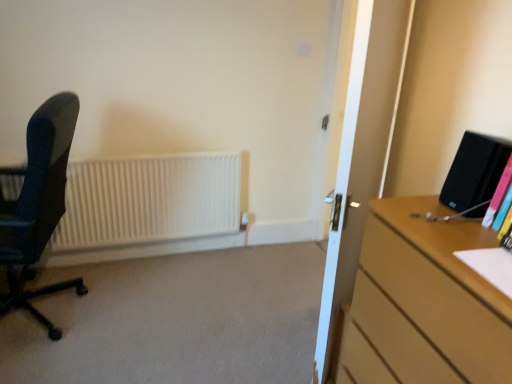
Question: Should I look upward or downward to see transparent glass door at center?

Choices:
 (A) up
 (B) down

Answer: (B)

Question: Is transparent glass door at center smaller than matte black office chair at left?

Choices:
 (A) yes
 (B) no

Answer: (A)

Question: From a real-world perspective, is transparent glass door at center beneath matte black office chair at left?

Choices:
 (A) yes
 (B) no

Answer: (B)

Question: Considering the relative positions of transparent glass door at center and matte black office chair at left in the image provided, is transparent glass door at center to the right of matte black office chair at left from the viewer's perspective?

Choices:
 (A) no
 (B) yes

Answer: (B)

Question: Can you confirm if transparent glass door at center is positioned to the left of matte black office chair at left?

Choices:
 (A) yes
 (B) no

Answer: (B)

Question: Is transparent glass door at center facing away from matte black office chair at left?

Choices:
 (A) yes
 (B) no

Answer: (B)

Question: Is transparent glass door at center thinner than matte black office chair at left?

Choices:
 (A) yes
 (B) no

Answer: (A)

Question: Considering the relative sizes of matte black office chair at left and transparent glass door at center in the image provided, is matte black office chair at left bigger than transparent glass door at center?

Choices:
 (A) no
 (B) yes

Answer: (B)

Question: Can you confirm if matte black office chair at left is wider than transparent glass door at center?

Choices:
 (A) no
 (B) yes

Answer: (B)

Question: Is matte black office chair at left facing away from transparent glass door at center?

Choices:
 (A) no
 (B) yes

Answer: (B)

Question: Considering the relative sizes of matte black office chair at left and transparent glass door at center in the image provided, is matte black office chair at left smaller than transparent glass door at center?

Choices:
 (A) no
 (B) yes

Answer: (A)

Question: Does matte black office chair at left contain transparent glass door at center?

Choices:
 (A) yes
 (B) no

Answer: (B)

Question: Is matte black office chair at left aimed at transparent glass door at center?

Choices:
 (A) no
 (B) yes

Answer: (A)

Question: Is transparent glass door at center oriented towards multicolored plastic book at right?

Choices:
 (A) no
 (B) yes

Answer: (A)